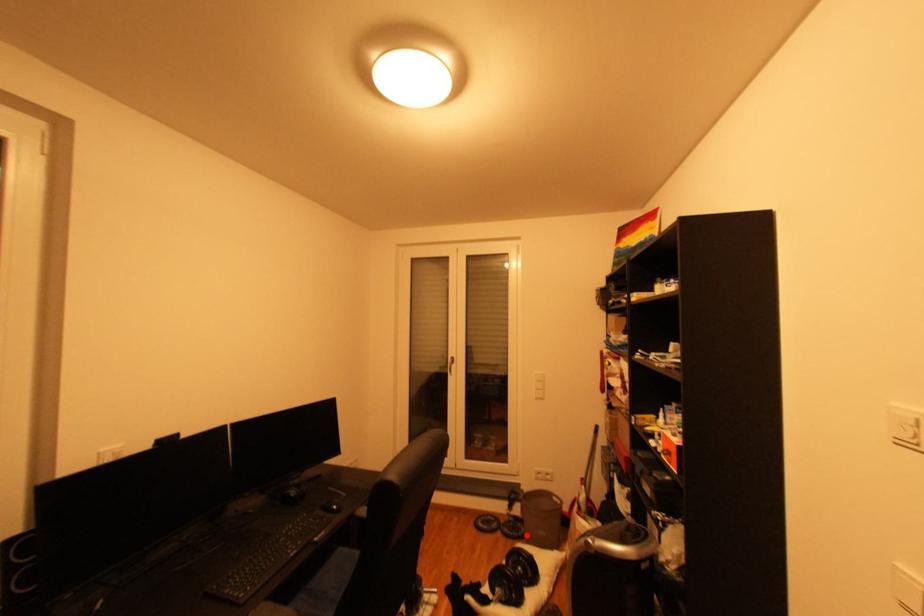
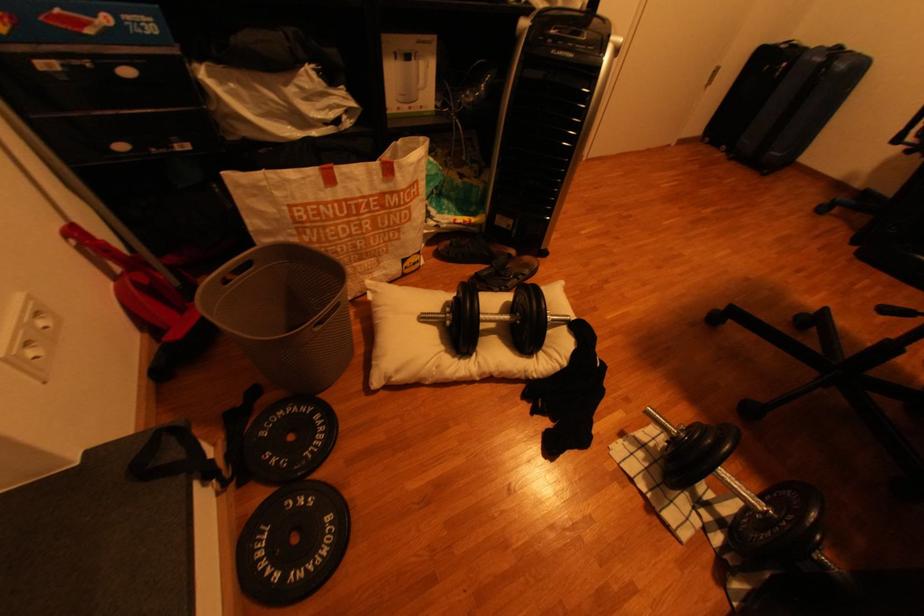
Question: I am providing you with two images of the same scene from different viewpoints. Given a red point in image1, look at the same physical point in image2. Is it:

Choices:
 (A) Closer to the viewpoint
 (B) Farther from the viewpoint

Answer: (A)